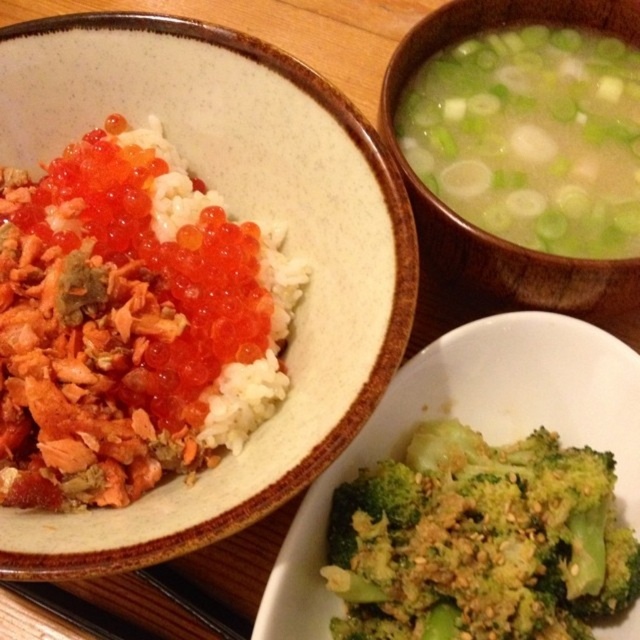
Between matte brown bowl at upper right and matte ceramic bowl at upper left, which one has more height?

Standing taller between the two is matte ceramic bowl at upper left.

The height and width of the screenshot is (640, 640). Find the location of `matte brown bowl at upper right`. matte brown bowl at upper right is located at coordinates (474, 227).

Identify the location of matte brown bowl at upper right. (474, 227).

Is point (339, 544) positioned behind point (380, 392)?

Yes, point (339, 544) is farther from viewer.

This screenshot has width=640, height=640. I want to click on green textured broccoli at lower right, so click(480, 540).

Does point (385, 608) come in front of point (397, 72)?

Yes, it is in front of point (397, 72).

Is green textured broccoli at lower right thinner than matte brown bowl at upper right?

Yes.

Is point (548, 563) in front of point (419, 198)?

Yes.

The image size is (640, 640). Find the location of `green textured broccoli at lower right`. green textured broccoli at lower right is located at coordinates (480, 540).